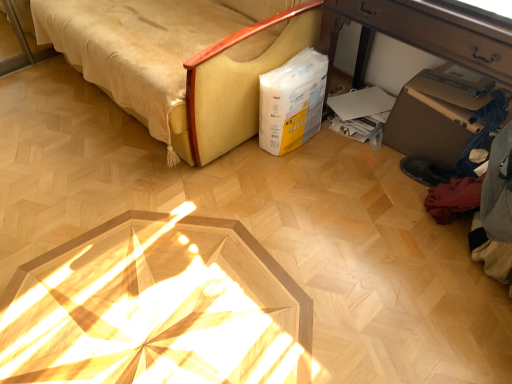
Where is `vacant space in between wooden desk at lower right and white paper bag at center-right`? The width and height of the screenshot is (512, 384). vacant space in between wooden desk at lower right and white paper bag at center-right is located at coordinates (348, 167).